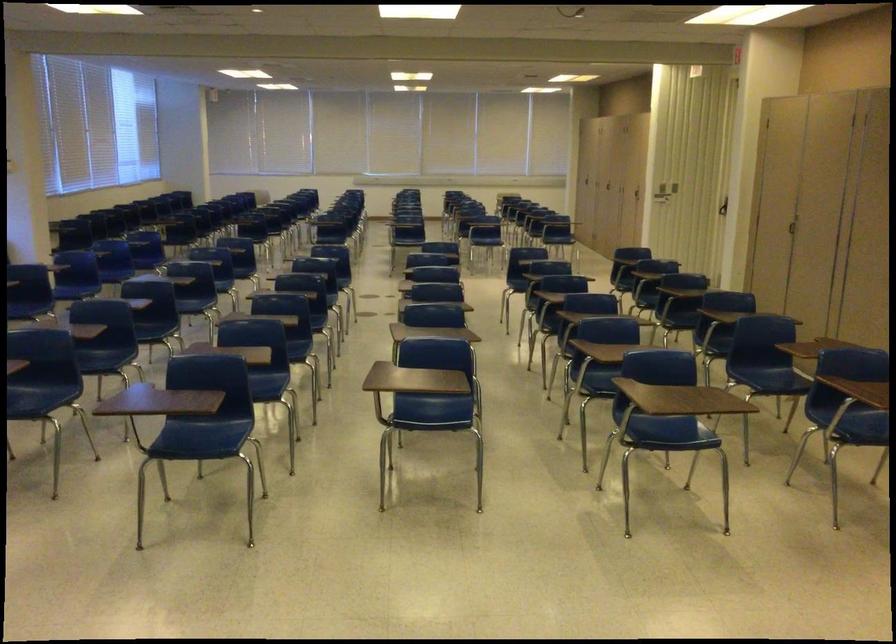
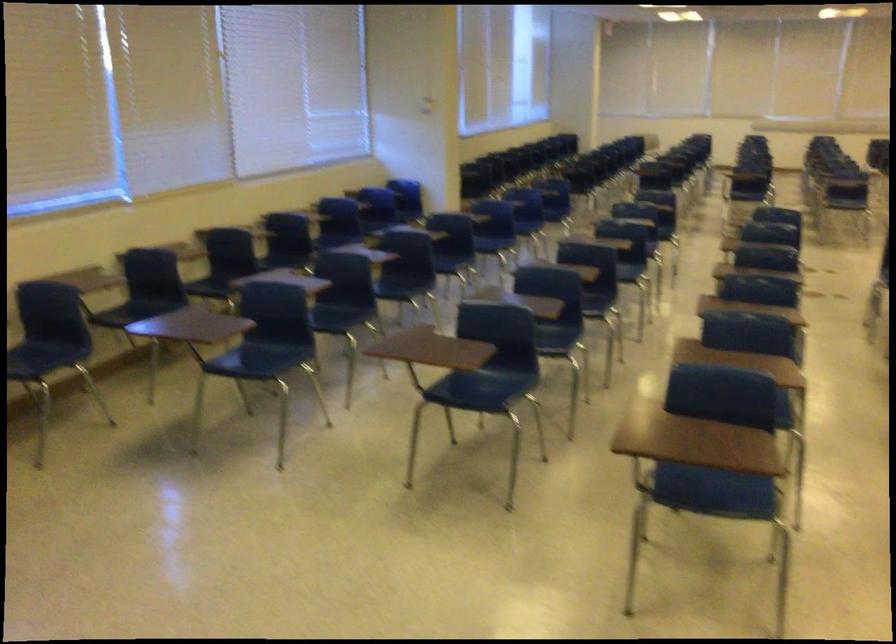
In a continuous first-person perspective shot, in which direction is the camera moving?

The cameraman walked toward left, forward.